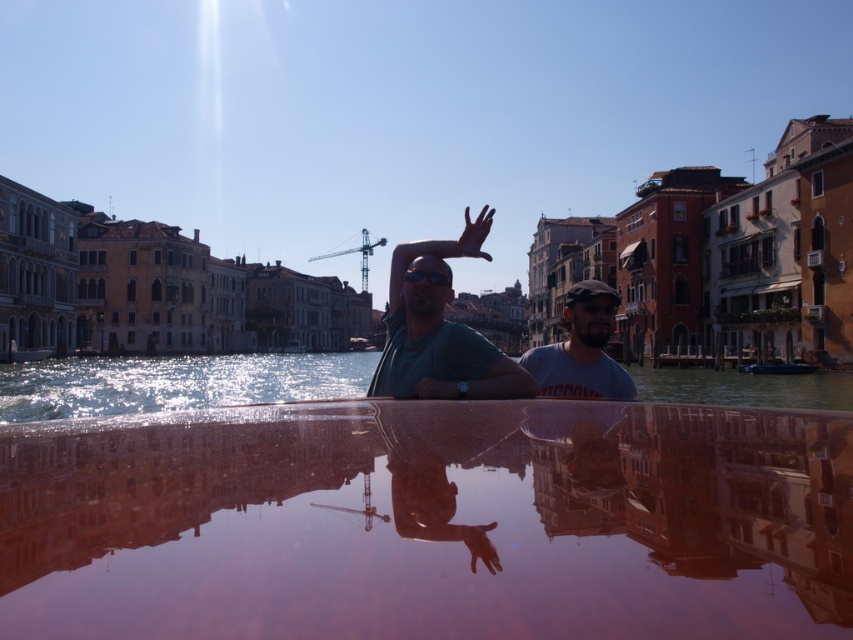
Is gray cotton t-shirt at center smaller than black plastic goggles at center?

No.

Does gray cotton t-shirt at center have a lesser width compared to black plastic goggles at center?

No, gray cotton t-shirt at center is not thinner than black plastic goggles at center.

Identify the location of gray cotton t-shirt at center. (581, 349).

Find the location of `gray cotton t-shirt at center`. gray cotton t-shirt at center is located at coordinates (581, 349).

Does shiny reflective water at center appear on the right side of black plastic goggles at center?

Yes, shiny reflective water at center is to the right of black plastic goggles at center.

You are a GUI agent. You are given a task and a screenshot of the screen. Output one action in this format:
    pyautogui.click(x=<x>, y=<y>)
    Task: Click on the shiny reflective water at center
    
    Given the screenshot: What is the action you would take?
    pyautogui.click(x=430, y=522)

Does point (437, 484) come in front of point (445, 278)?

Yes, point (437, 484) is in front of point (445, 278).

This screenshot has height=640, width=853. In order to click on shiny reflective water at center in this screenshot , I will do tap(430, 522).

Does shiny reflective water at center appear on the right side of gray cotton t-shirt at center?

In fact, shiny reflective water at center is to the left of gray cotton t-shirt at center.

Which is in front, point (354, 522) or point (579, 317)?

Point (354, 522) is more forward.

Describe the element at coordinates (430, 522) in the screenshot. The image size is (853, 640). I see `shiny reflective water at center` at that location.

Image resolution: width=853 pixels, height=640 pixels. I want to click on shiny reflective water at center, so click(430, 522).